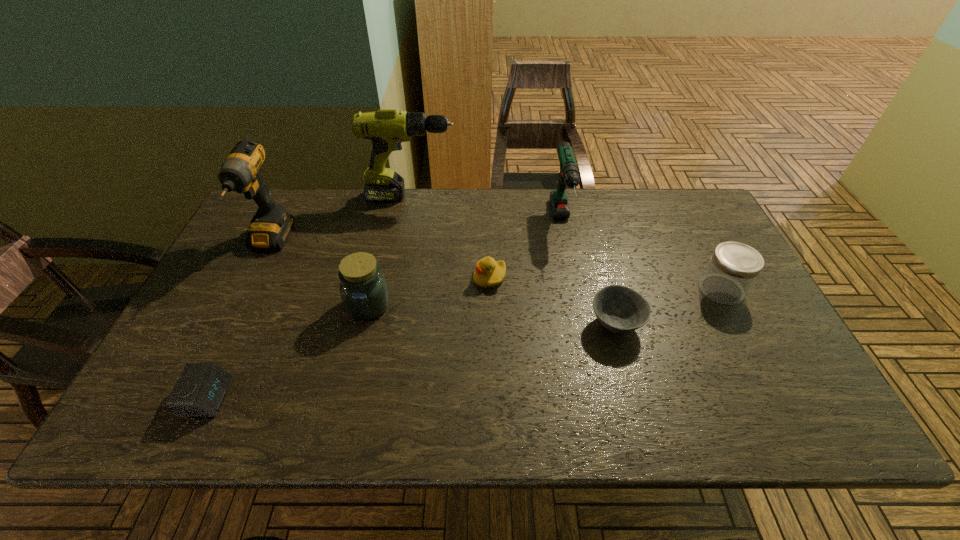
This screenshot has width=960, height=540. Identify the location of the second drill from left to right. (387, 129).

Where is `the leftmost drill`? the leftmost drill is located at coordinates (271, 225).

At what (x,y) coordinates should I click in order to perform the action: click on the shortest drill. Please return your answer as a coordinate pair (x, y). This screenshot has width=960, height=540. Looking at the image, I should click on (569, 173).

Identify the location of the third tallest object. (569, 173).

Find the location of a particular element. the left jar is located at coordinates (364, 292).

Where is `the fifth shortest object`? The width and height of the screenshot is (960, 540). the fifth shortest object is located at coordinates (364, 292).

The width and height of the screenshot is (960, 540). What are the coordinates of `the shorter jar` in the screenshot? It's located at (733, 267).

Find the location of a particular element. the rightmost object is located at coordinates (733, 267).

This screenshot has width=960, height=540. Find the location of `the fourth object from right to left`. the fourth object from right to left is located at coordinates (488, 273).

Identify the location of bowl. The width and height of the screenshot is (960, 540). (620, 309).